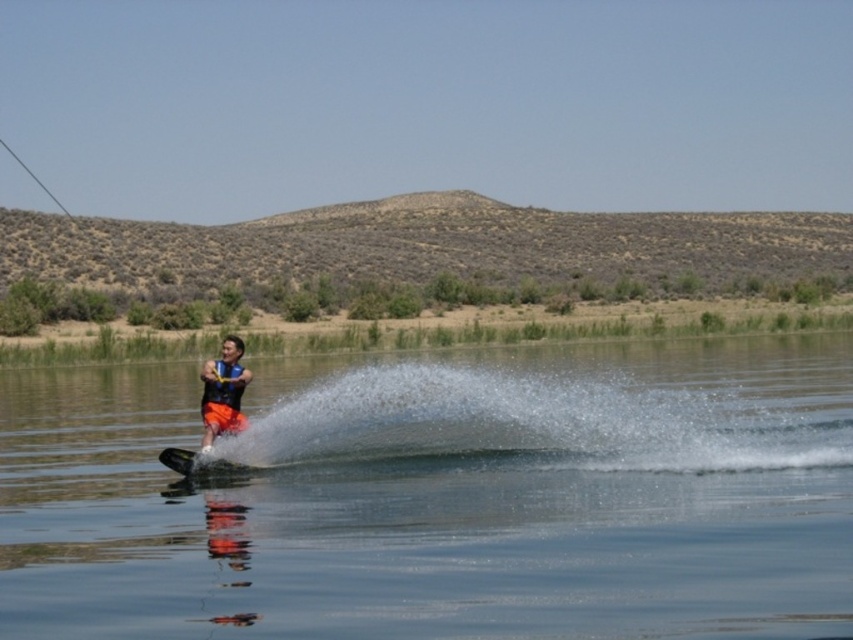
Question: Does clear water at center have a smaller size compared to orange life vest at center?

Choices:
 (A) yes
 (B) no

Answer: (B)

Question: Based on their relative distances, which object is farther from the black matte water ski at lower center?

Choices:
 (A) clear water at center
 (B) orange life vest at center

Answer: (A)

Question: Which object is the closest to the orange life vest at center?

Choices:
 (A) clear water at center
 (B) black matte water ski at lower center

Answer: (B)

Question: Considering the real-world distances, which object is closest to the clear water at center?

Choices:
 (A) orange life vest at center
 (B) black matte water ski at lower center

Answer: (B)

Question: Observing the image, what is the correct spatial positioning of clear water at center in reference to black matte water ski at lower center?

Choices:
 (A) right
 (B) left

Answer: (A)

Question: Is orange life vest at center positioned in front of black matte water ski at lower center?

Choices:
 (A) yes
 (B) no

Answer: (B)